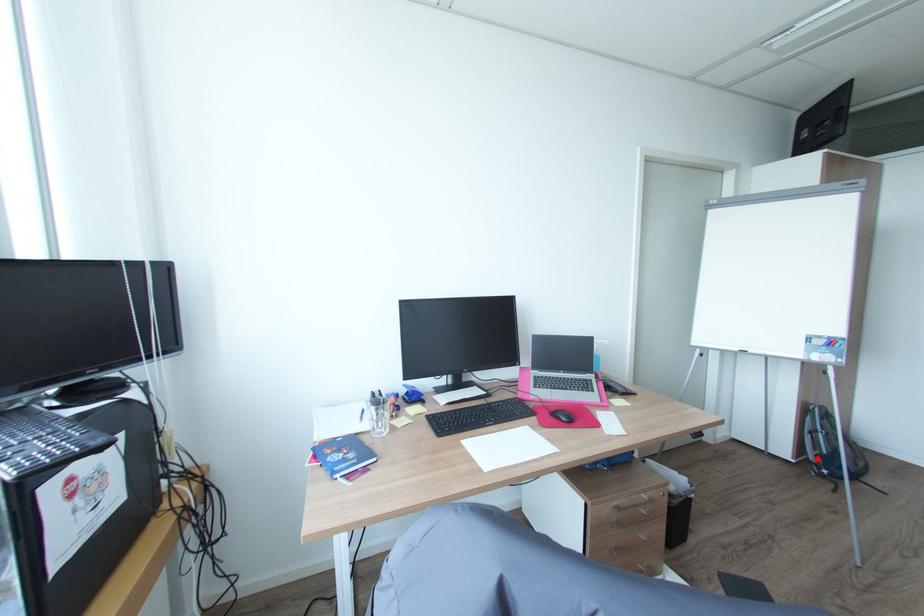
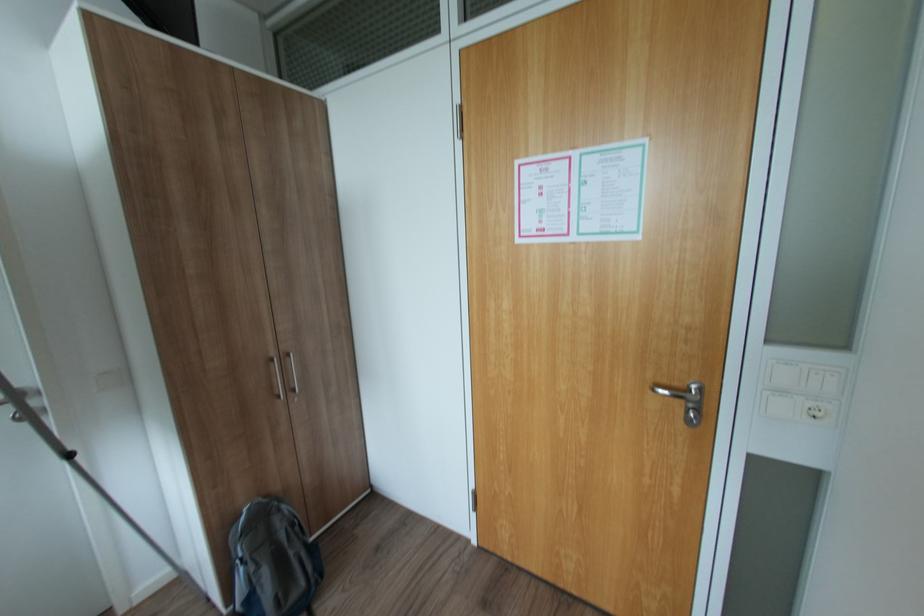
Locate, in the second image, the point that corresponds to the highlighted location in the first image.

(244, 608)